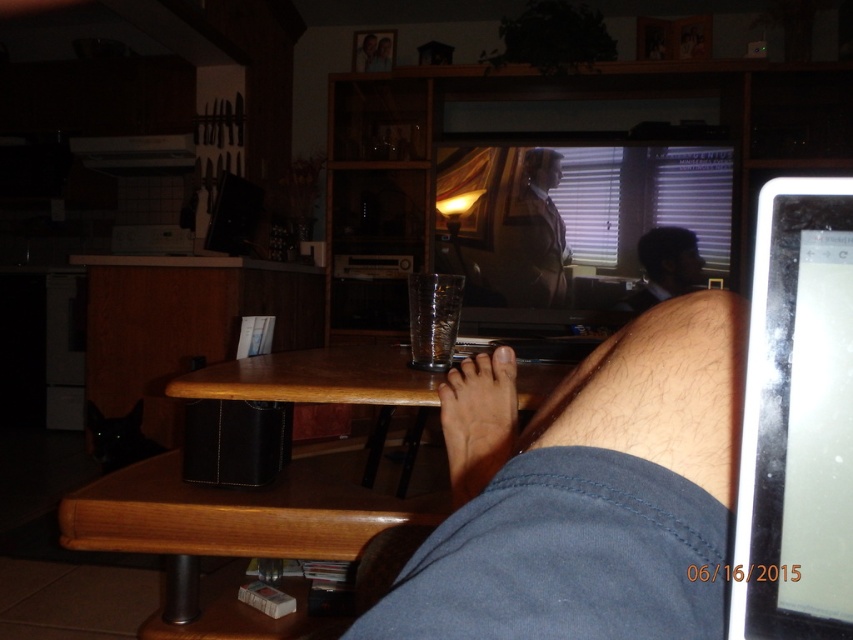
Is matte black tablet at right to the right of matte black laptop at upper center from the viewer's perspective?

No, matte black tablet at right is not to the right of matte black laptop at upper center.

Measure the distance between matte black tablet at right and camera.

They are 11.43 inches apart.

At what (x,y) coordinates should I click in order to perform the action: click on matte black tablet at right. Please return your answer as a coordinate pair (x, y). The image size is (853, 640). Looking at the image, I should click on (798, 419).

Consider the image. Can you confirm if matte black tablet at right is shorter than brown leather jacket at upper center?

Yes.

Does point (747, 420) lie behind point (537, 253)?

No, it is in front of (537, 253).

Where is `matte black tablet at right`? The height and width of the screenshot is (640, 853). matte black tablet at right is located at coordinates (798, 419).

Is matte black tablet at right positioned in front of wooden table at lower center?

Yes, matte black tablet at right is in front of wooden table at lower center.

Measure the distance between matte black tablet at right and camera.

The distance of matte black tablet at right from camera is 11.43 inches.

The height and width of the screenshot is (640, 853). I want to click on matte black tablet at right, so click(798, 419).